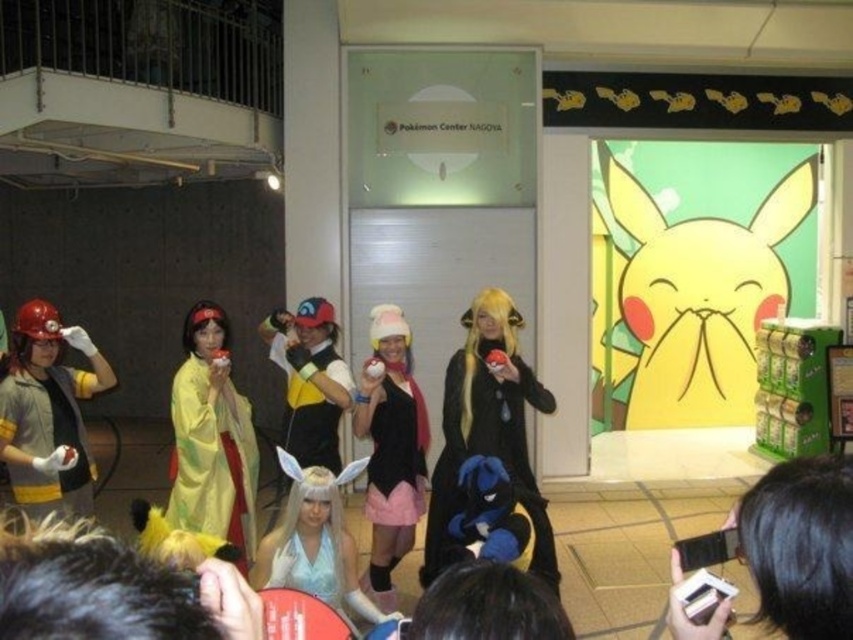
Which is behind, point (523, 589) or point (299, 560)?

The point (299, 560) is more distant.

Does silky blue hair at center have a greater height compared to shiny silver dress at center?

Incorrect, silky blue hair at center's height is not larger of shiny silver dress at center's.

Image resolution: width=853 pixels, height=640 pixels. What are the coordinates of `silky blue hair at center` in the screenshot? It's located at (485, 605).

At what (x,y) coordinates should I click in order to perform the action: click on silky blue hair at center. Please return your answer as a coordinate pair (x, y). This screenshot has height=640, width=853. Looking at the image, I should click on (485, 605).

Measure the distance between point (788, 540) and camera.

37.95 inches

Looking at this image, can you confirm if smooth black phone at lower right is positioned below yellow satin kimono at center?

No, smooth black phone at lower right is not below yellow satin kimono at center.

Does point (850, 576) come farther from viewer compared to point (222, 413)?

That is False.

The height and width of the screenshot is (640, 853). In order to click on smooth black phone at lower right in this screenshot , I will do `click(799, 545)`.

Is shiny yellow wig at center in front of yellow satin kimono at center?

Yes, it is in front of yellow satin kimono at center.

I want to click on shiny yellow wig at center, so click(112, 589).